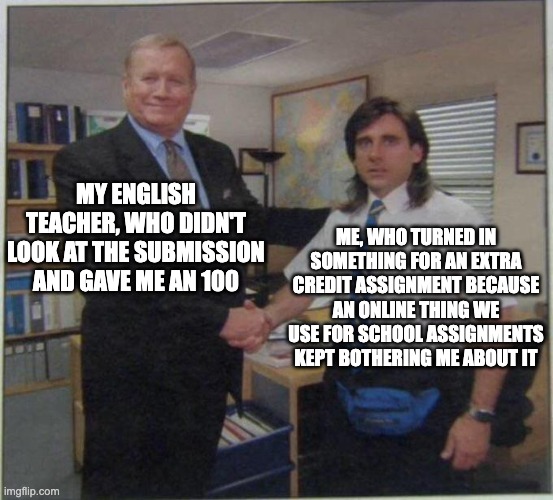
Find the location of a particular element. The width and height of the screenshot is (553, 500). shelves is located at coordinates (45, 385), (39, 333), (39, 146), (33, 201), (20, 290).